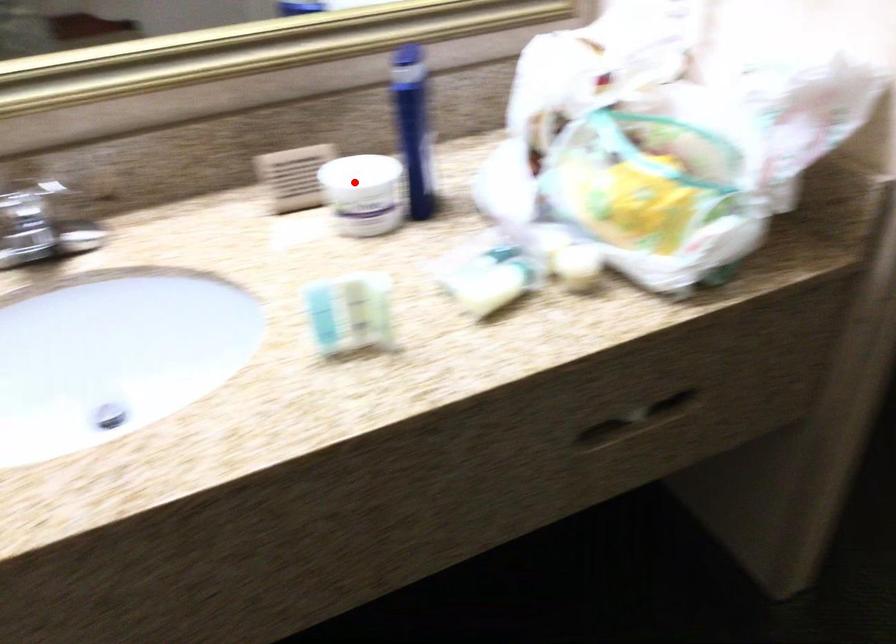
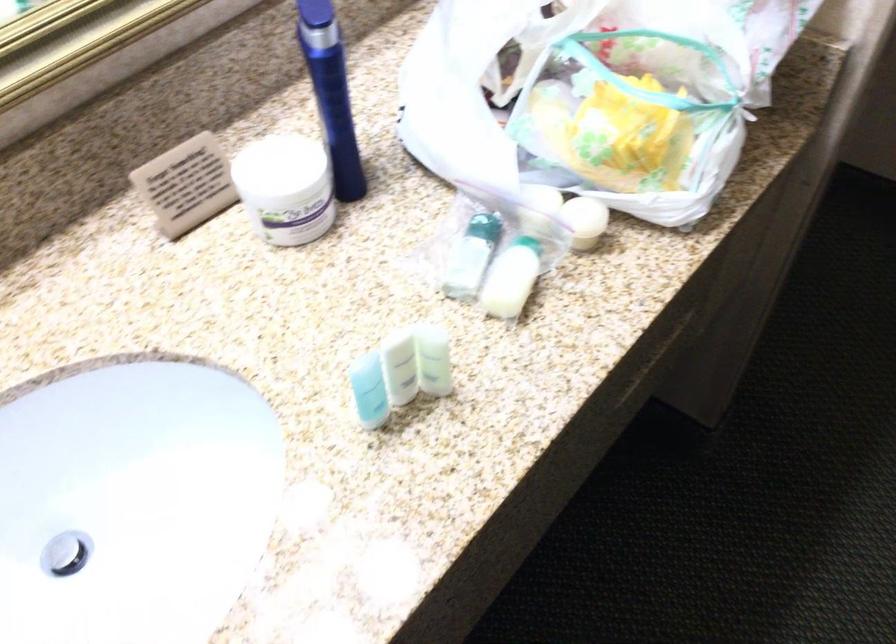
Where in the second image is the point corresponding to the highlighted location from the first image?

(286, 187)